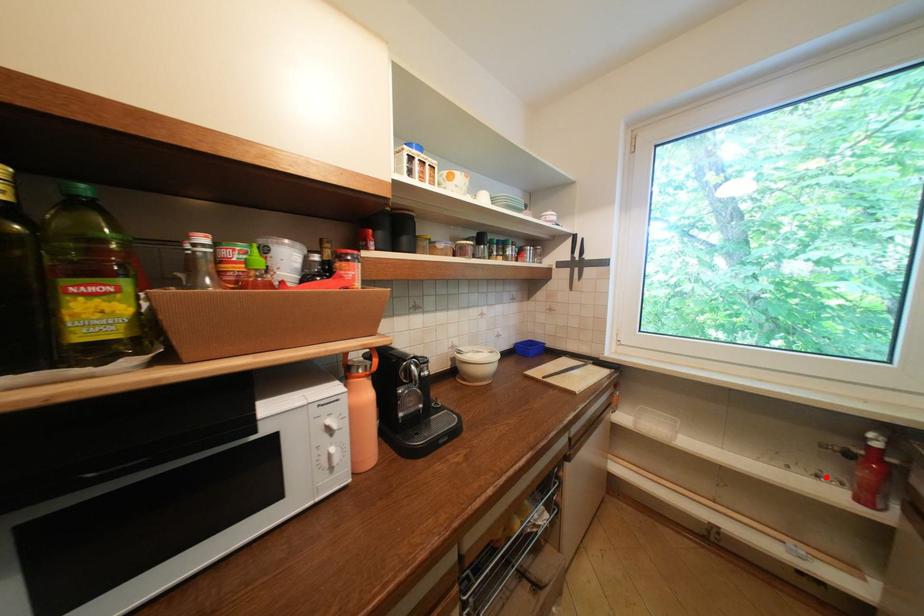
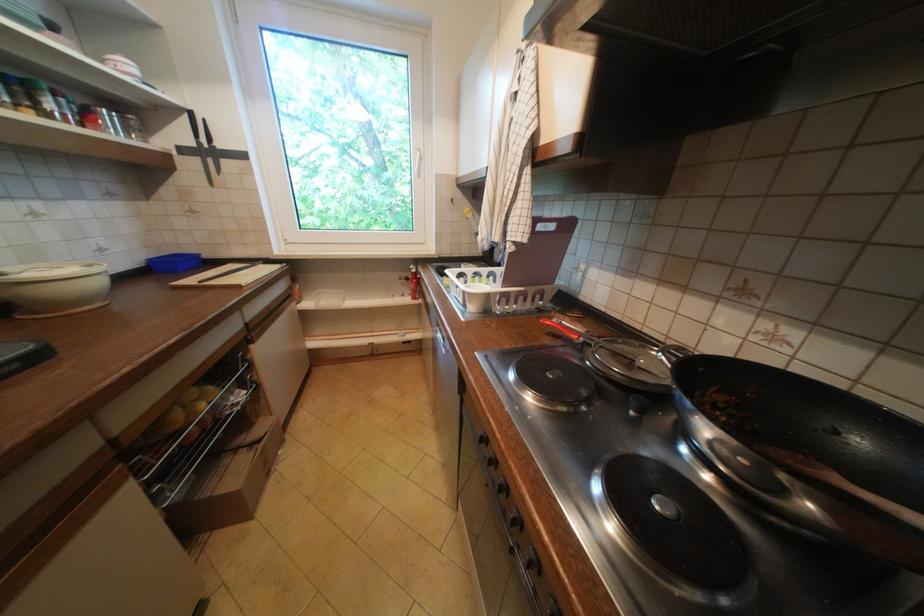
In the second image, find the point that corresponds to the highlighted location in the first image.

(410, 296)